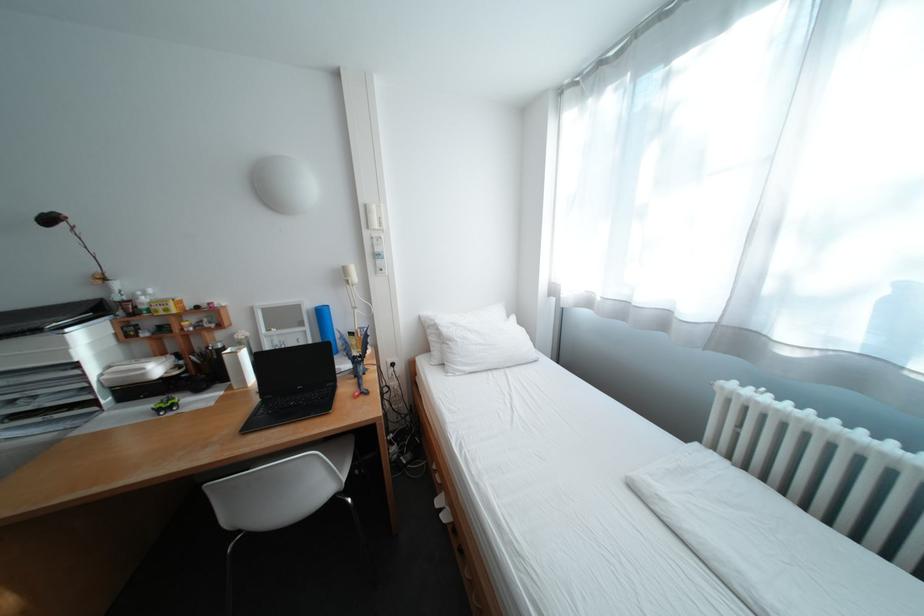
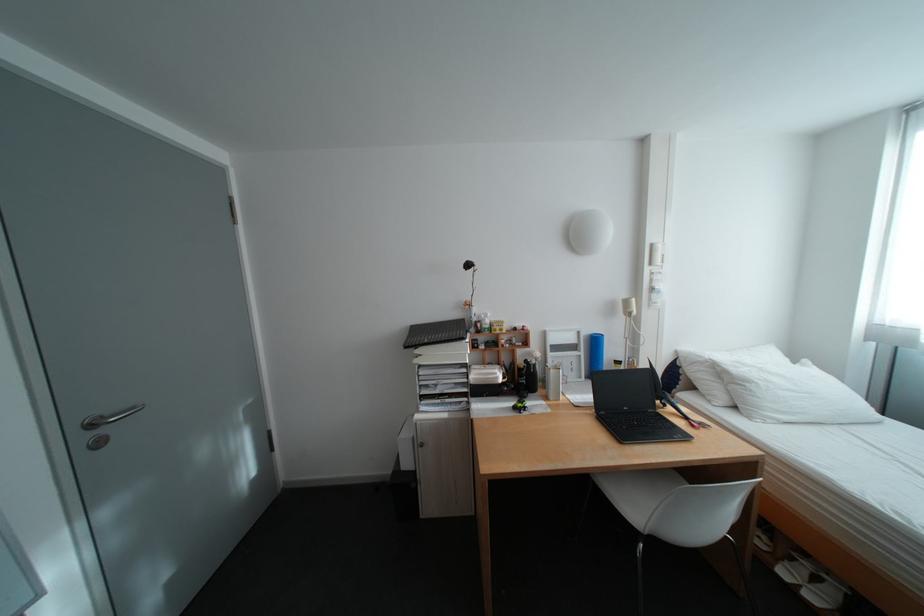
Locate, in the second image, the point that corresponds to the point at 465,342 in the first image.

(761, 384)